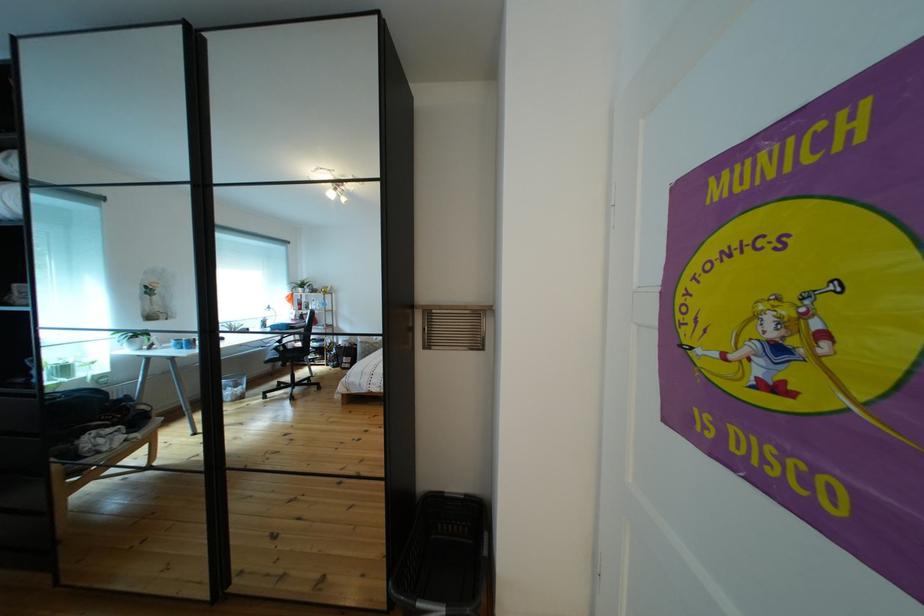
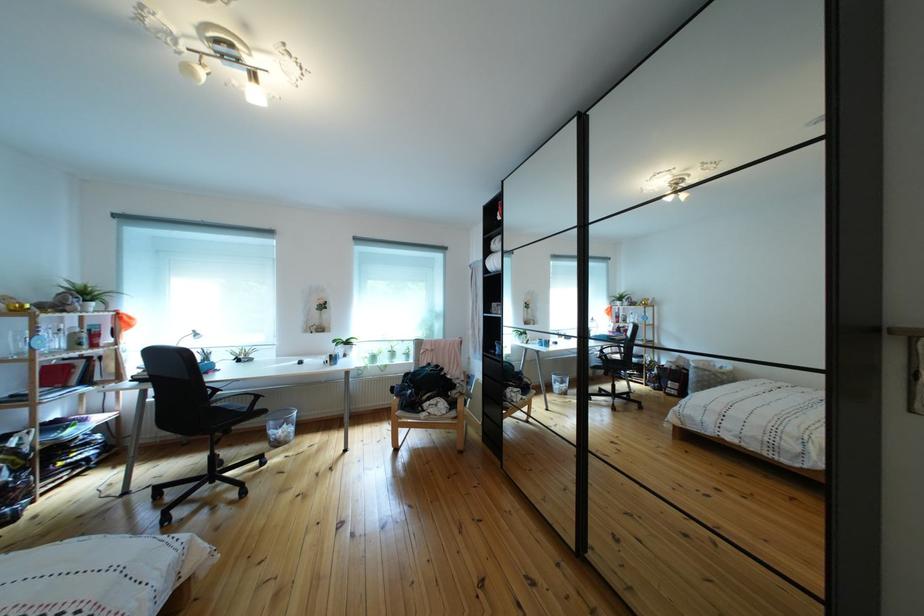
Question: The images are taken continuously from a first-person perspective. In which direction is your viewpoint rotating?

Choices:
 (A) Left
 (B) Right
 (C) Up
 (D) Down

Answer: (A)